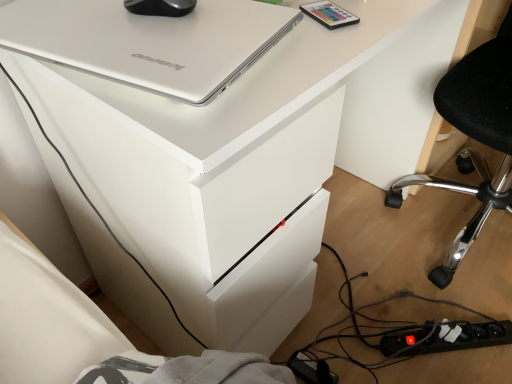
Question: In terms of size, does black plastic power strip at lower right appear bigger or smaller than black rubberized mouse at upper center?

Choices:
 (A) big
 (B) small

Answer: (A)

Question: Does point (475, 332) appear closer or farther from the camera than point (152, 8)?

Choices:
 (A) closer
 (B) farther

Answer: (B)

Question: Considering the real-world distances, which object is closest to the black plastic chair at lower right?

Choices:
 (A) black plastic power strip at lower right
 (B) matte plastic remote control at upper right
 (C) silver metallic laptop at upper left
 (D) black rubberized mouse at upper center

Answer: (A)

Question: Which of these objects is positioned closest to the black plastic power strip at lower right?

Choices:
 (A) matte plastic remote control at upper right
 (B) black plastic chair at lower right
 (C) silver metallic laptop at upper left
 (D) black rubberized mouse at upper center

Answer: (B)